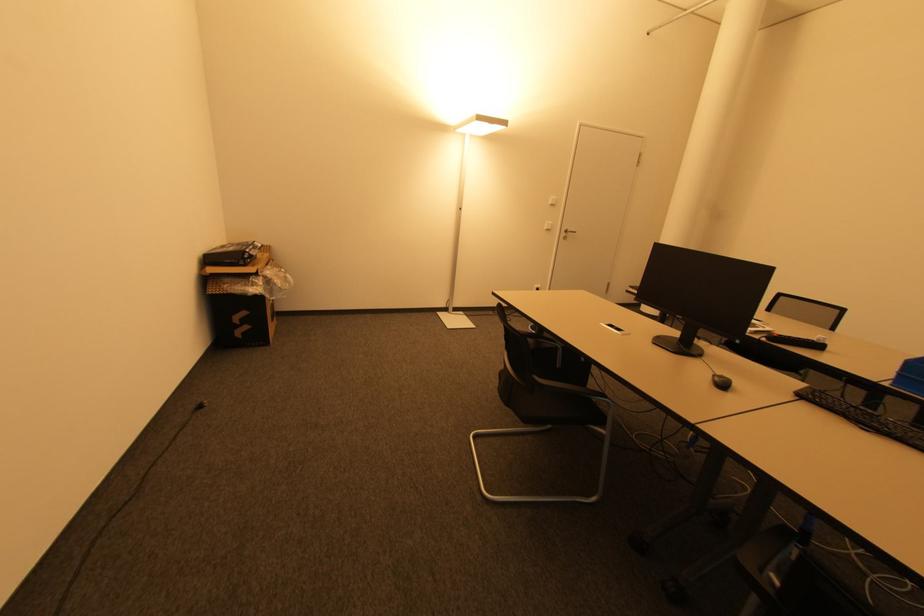
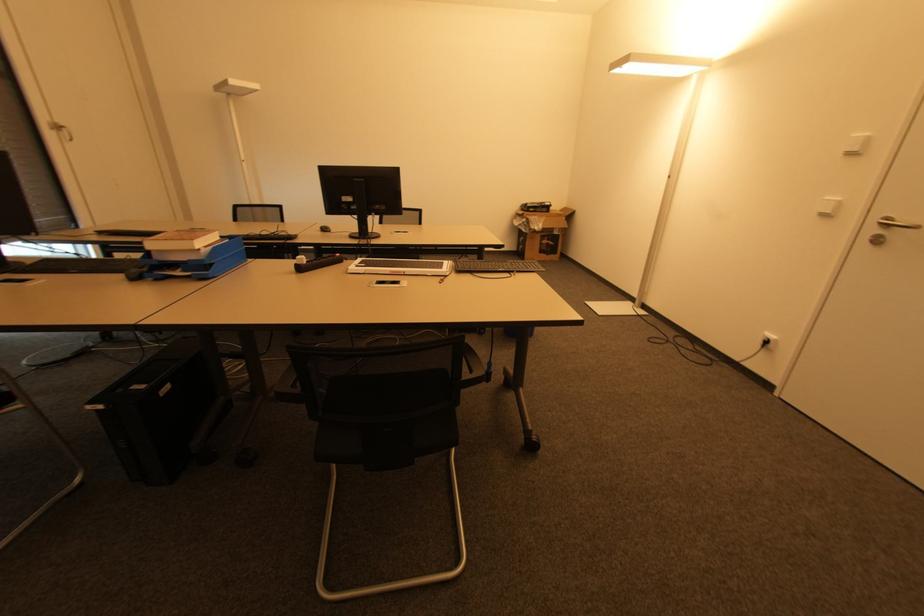
The point at (568, 230) is marked in the first image. Where is the corresponding point in the second image?

(890, 221)